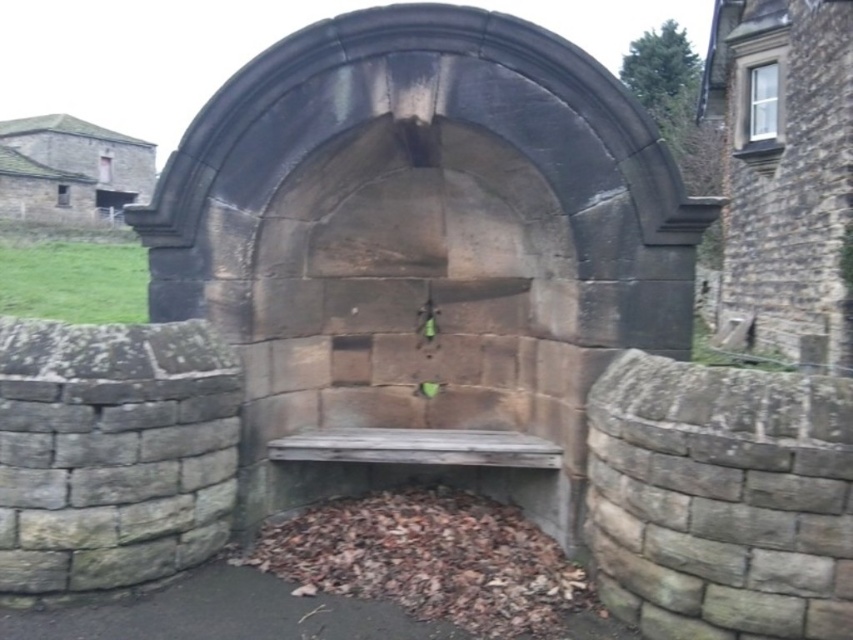
Can you confirm if stone archway at center is thinner than weathered wood bench at center?

In fact, stone archway at center might be wider than weathered wood bench at center.

Does stone archway at center have a larger size compared to weathered wood bench at center?

Yes.

This screenshot has height=640, width=853. What are the coordinates of `stone archway at center` in the screenshot? It's located at (424, 240).